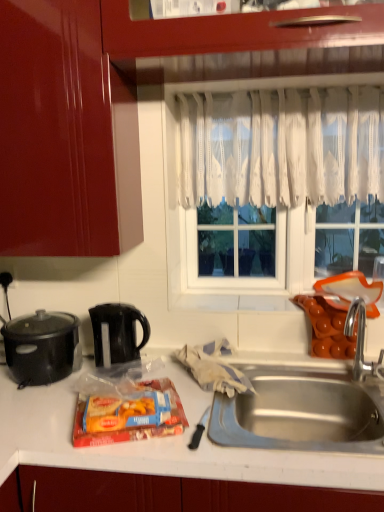
Question: Is white lace curtain at center situated inside black plastic kettle at center-left, which is counted as the second kitchen appliance, starting from the left, or outside?

Choices:
 (A) outside
 (B) inside

Answer: (A)

Question: Is white lace curtain at center bigger or smaller than black plastic kettle at center-left, which is counted as the second kitchen appliance, starting from the left?

Choices:
 (A) small
 (B) big

Answer: (B)

Question: Which of these objects is positioned closest to the white lace curtain at center?

Choices:
 (A) white lace curtain at upper center
 (B) black plastic kettle at center-left, which is the first kitchen appliance from right to left
 (C) matte plastic snack pack at center
 (D) silver metallic faucet at sink right
 (E) black matte slow cooker at left, which is the first kitchen appliance in left-to-right order

Answer: (A)

Question: Which object is positioned farthest from the black matte slow cooker at left, the second kitchen appliance in the right-to-left sequence?

Choices:
 (A) white lace curtain at center
 (B) silver metallic faucet at sink right
 (C) matte plastic snack pack at center
 (D) black plastic kettle at center-left, which is the first kitchen appliance from right to left
 (E) white lace curtain at upper center

Answer: (B)